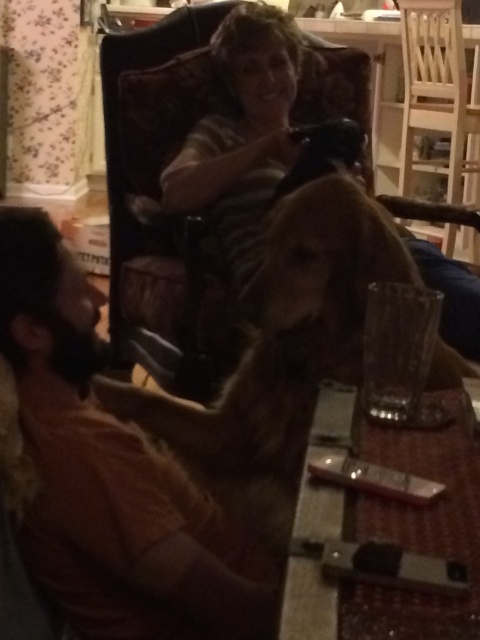
You are organizing a charity clothing drive and need to determine which items are appropriate for adults. You see the brown fuzzy sweater at left and the striped shirt at upper center in the image. Based on their sizes, which one is more likely to be adult clothing?

The striped shirt at upper center is more likely to be adult clothing because it has a larger size compared to the brown fuzzy sweater at left.

You are trying to reach the metallic silver remote at center from your current position near the striped shirt at upper center. Considering their sizes, do you think you can easily grab the remote without moving too much?

The striped shirt at upper center might be wider than metallic silver remote at center, so it could block access to the remote. You might need to adjust your position slightly to reach it.

Consider the image. You are trying to decide which item to grab first from the floor in the image. The brown fuzzy sweater at left and the striped shirt at upper center are both within reach. Based on their sizes, which one should you pick up first if you want to start with the smaller item?

The brown fuzzy sweater at left has a lesser width compared to the striped shirt at upper center, so you should pick up the brown fuzzy sweater at left first since it is smaller in width.